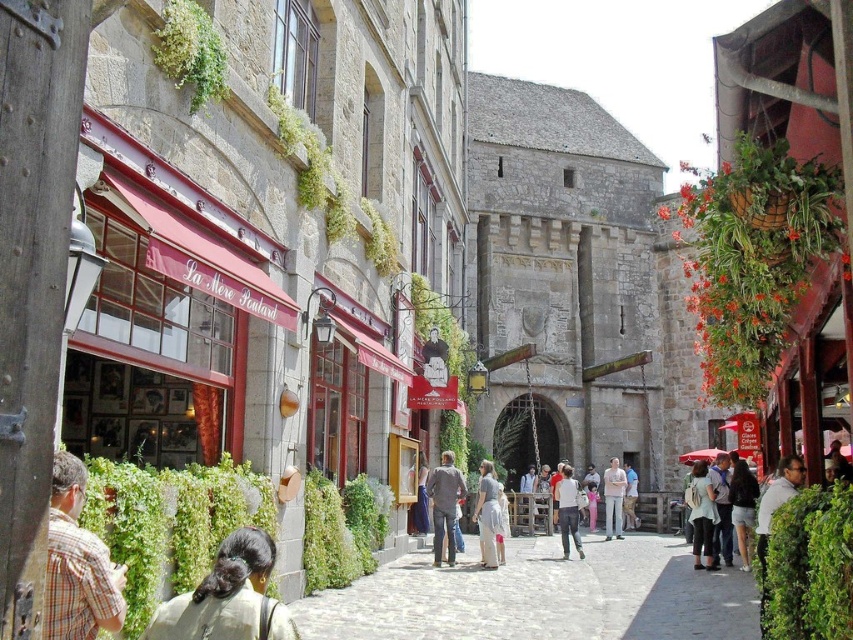
You are standing on the cobblestone street in the historic European town depicted. You notice a dark brown hair at lower left located at point [228,596]. If you were to walk directly towards the dark brown hair at lower left, which direction should you move relative to your current position?

The dark brown hair at lower left is located at point [228,596]. Since this coordinate places it at the lower left of the image, you should move towards the lower left direction to reach it.

You are standing at the center of the street in the historic European town. You see a person with dark brown hair at lower left. If you want to approach them, in which direction should you move relative to your current position?

To approach the dark brown hair at lower left, you should move towards the lower left direction from your current position at the center of the street.